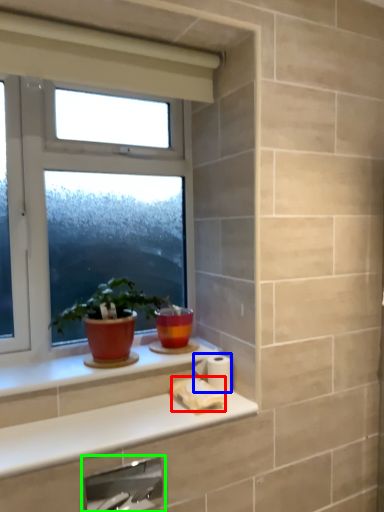
Question: Based on their relative distances, which object is farther from toilet paper (highlighted by a red box)? Choose from toilet paper (highlighted by a blue box) and faucet (highlighted by a green box).

Choices:
 (A) toilet paper
 (B) faucet

Answer: (B)